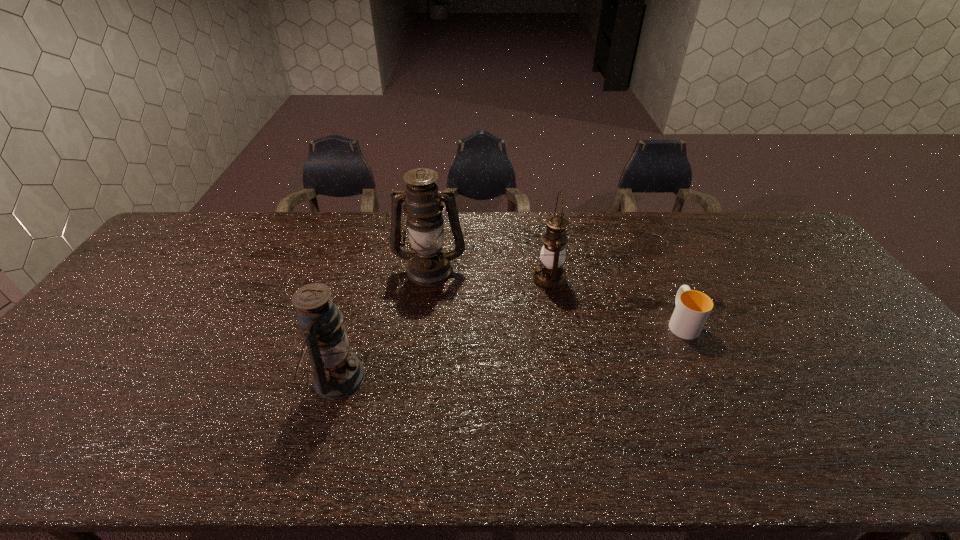
Where is `object that is the nearest to the leftmost object`? The image size is (960, 540). object that is the nearest to the leftmost object is located at coordinates (429, 264).

This screenshot has height=540, width=960. What are the coordinates of `oil lamp identified as the closest to the second object from right to left` in the screenshot? It's located at (429, 264).

The image size is (960, 540). Find the location of `oil lamp that is the second closest to the second oil lamp from left to right`. oil lamp that is the second closest to the second oil lamp from left to right is located at coordinates (337, 372).

Locate an element on the screen. The height and width of the screenshot is (540, 960). free space that satisfies the following two spatial constraints: 1. on the back side of the third object from left to right; 2. on the left side of the nearest oil lamp is located at coordinates (365, 280).

You are a GUI agent. You are given a task and a screenshot of the screen. Output one action in this format:
    pyautogui.click(x=<x>, y=<y>)
    Task: Click on the free space that satisfies the following two spatial constraints: 1. on the back side of the nearest oil lamp; 2. on the left side of the rightmost oil lamp
    The width and height of the screenshot is (960, 540).
    Given the screenshot: What is the action you would take?
    pyautogui.click(x=365, y=280)

Image resolution: width=960 pixels, height=540 pixels. I want to click on vacant space that satisfies the following two spatial constraints: 1. on the back side of the rightmost oil lamp; 2. on the right side of the nearest oil lamp, so click(x=365, y=280).